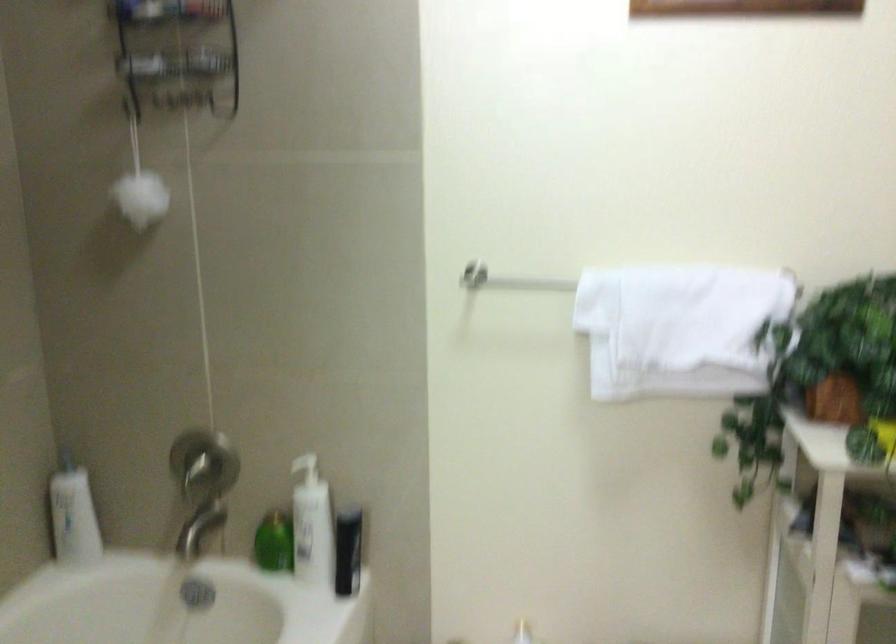
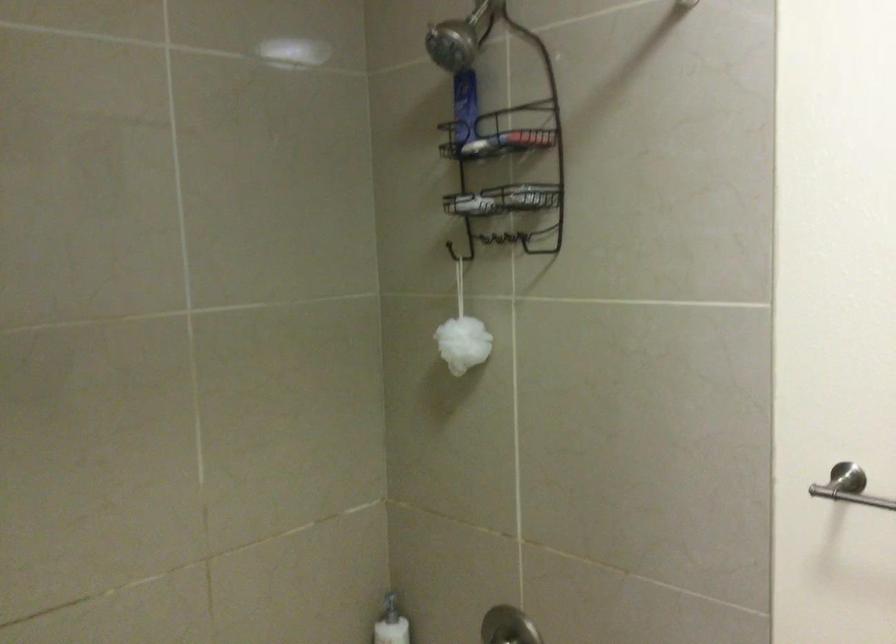
Question: How did the camera likely rotate?

Choices:
 (A) Left
 (B) Right
 (C) Up
 (D) Down

Answer: (A)